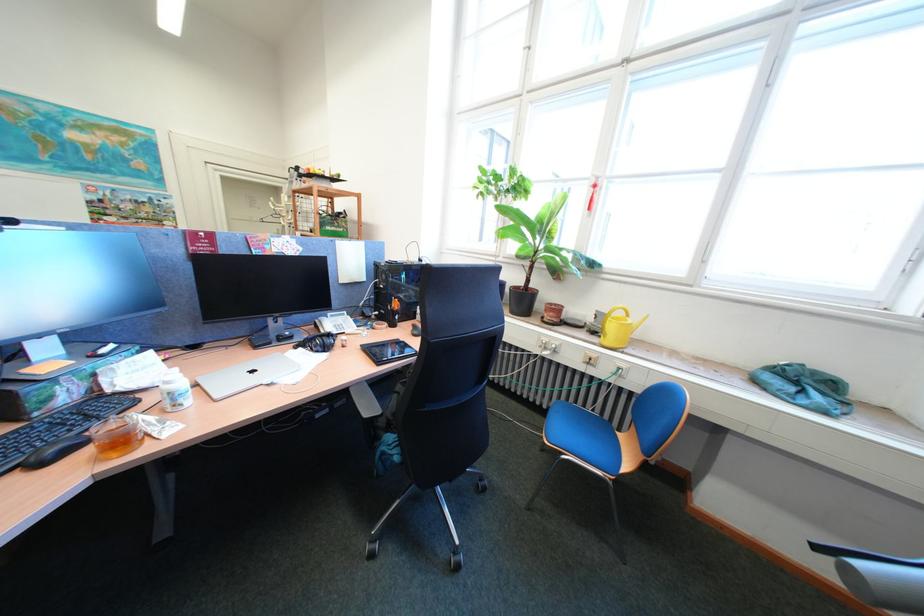
Find the location of `telephone handset`. telephone handset is located at coordinates (334, 323).